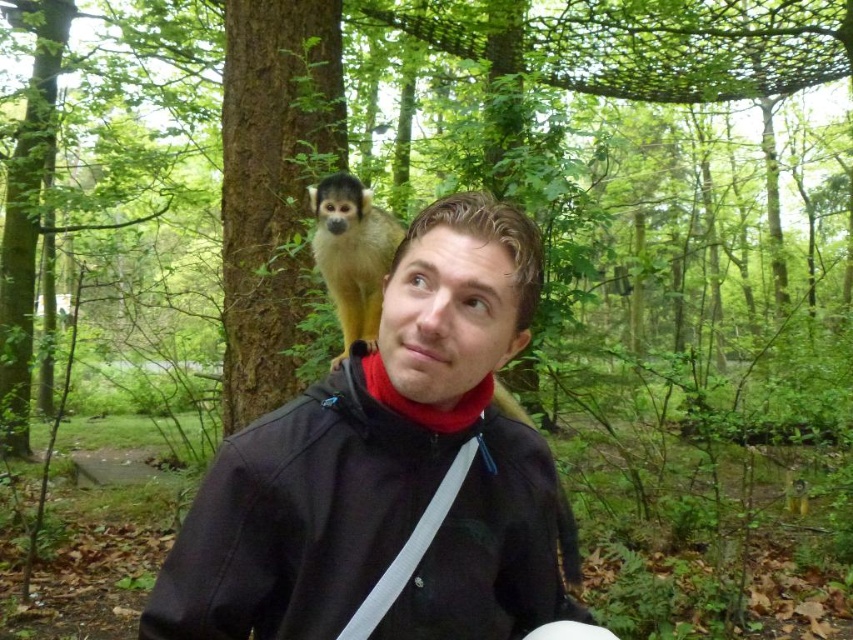
Who is more forward, (326,419) or (351,214)?

Point (326,419)

Is matte black jacket at center above squirrel monkey at upper center?

Actually, matte black jacket at center is below squirrel monkey at upper center.

Does point (305, 392) lie in front of point (325, 237)?

Yes, it is.

Locate an element on the screen. matte black jacket at center is located at coordinates (390, 468).